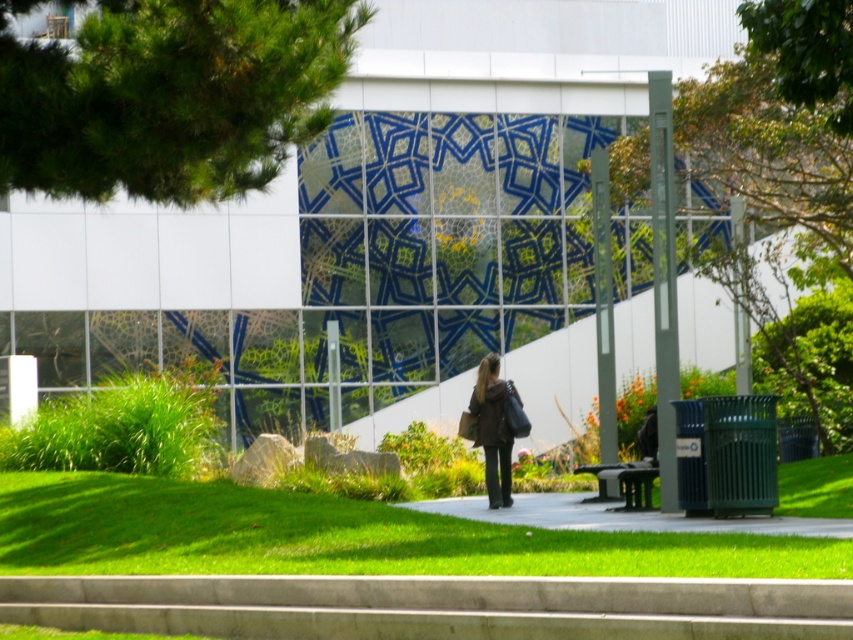
Based on the photo, you are a landscape architect designing a garden. You have a limited budget and must choose between expanding the green grass at lower center or the green leafy tree at right. Given their sizes, which area would you prioritize for expansion to cover more ground efficiently?

The green grass at lower center has a larger width than the green leafy tree at right, so expanding the green grass at lower center would cover more ground efficiently.

You are a landscape architect designing a garden. You have a limited budget and need to choose between the green leafy tree at upper left and the green grass at lower center for a space that requires a wider base. Which option should you choose?

The green grass at lower center has a wider base than the green leafy tree at upper left, so you should choose the green grass at lower center for the space that requires a wider base.